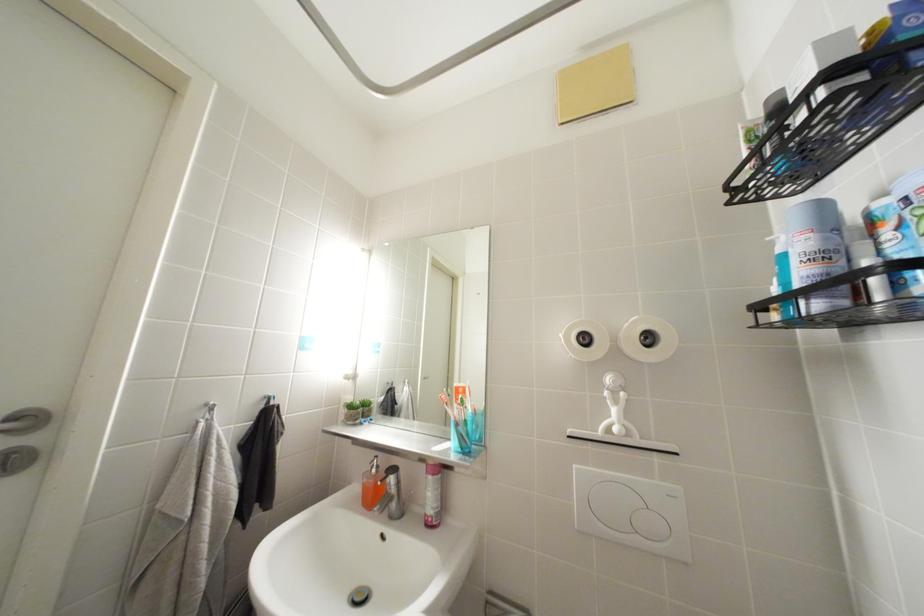
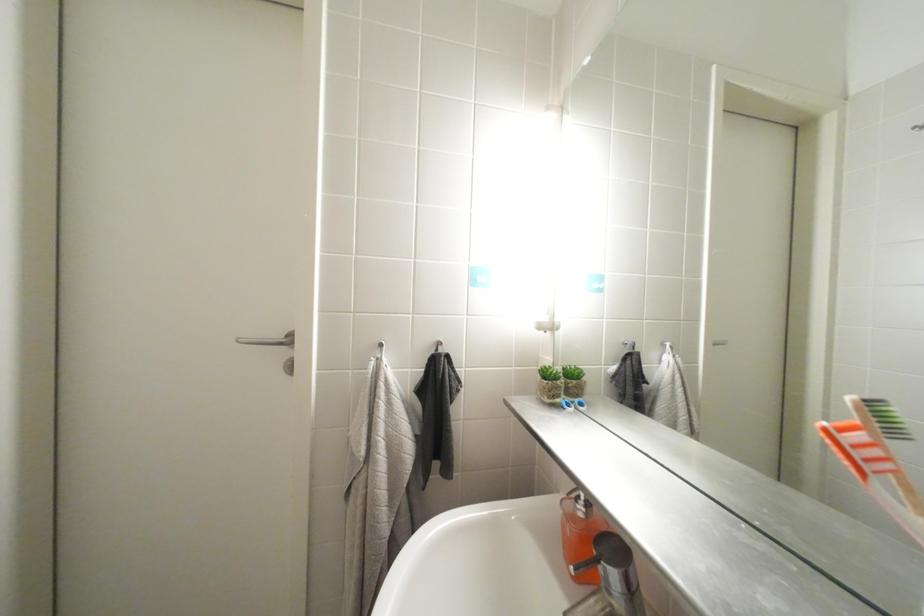
Question: The camera is either moving clockwise (left) or counter-clockwise (right) around the object. The first image is from the beginning of the video and the second image is from the end. Is the camera moving left or right when shooting the video?

Choices:
 (A) Left
 (B) Right

Answer: (B)